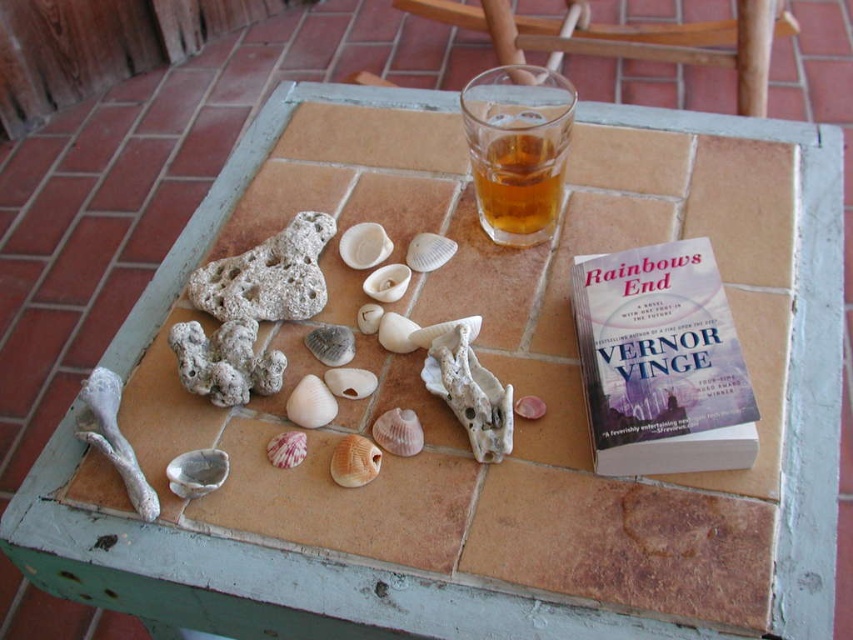
Which of these two, matte purple cover at upper right or translucent glass at upper center, stands taller?

Standing taller between the two is matte purple cover at upper right.

Where is `matte purple cover at upper right`? This screenshot has height=640, width=853. matte purple cover at upper right is located at coordinates (660, 362).

Does matte purple cover at upper right appear over smooth beige shell at center?

Yes, matte purple cover at upper right is above smooth beige shell at center.

Locate an element on the screen. This screenshot has width=853, height=640. matte purple cover at upper right is located at coordinates (660, 362).

Does translucent glass at upper center appear under smooth beige shell at center?

No, translucent glass at upper center is not below smooth beige shell at center.

Does translucent glass at upper center have a lesser height compared to smooth beige shell at center?

In fact, translucent glass at upper center may be taller than smooth beige shell at center.

Identify the location of translucent glass at upper center. (517, 148).

I want to click on translucent glass at upper center, so click(x=517, y=148).